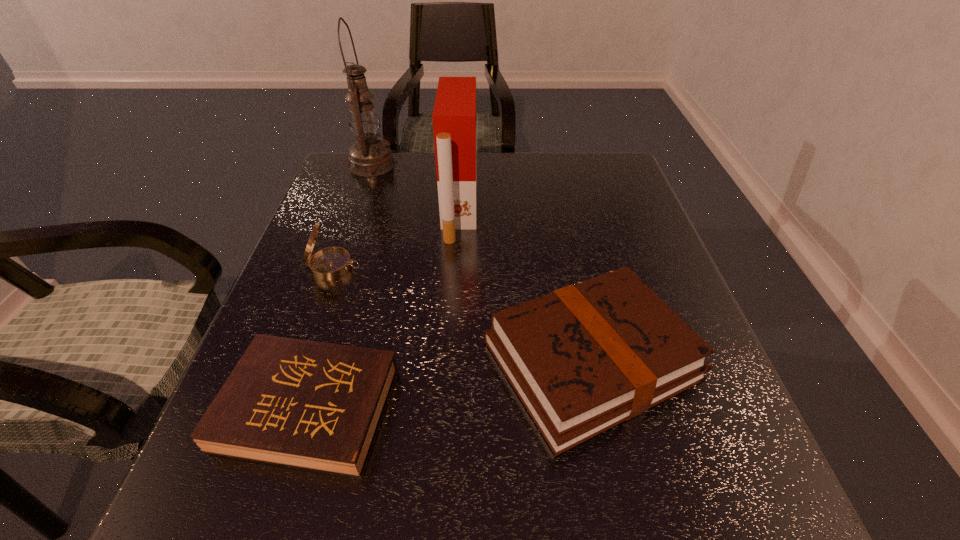
What are the coordinates of `free space located on the right of the oil lamp` in the screenshot? It's located at (412, 164).

Identify the location of vacant area situated on the front-facing side of the cigarette case. (496, 210).

Where is `vacant space located 0.260m with the dial facing the third nearest object`? The width and height of the screenshot is (960, 540). vacant space located 0.260m with the dial facing the third nearest object is located at coordinates (476, 267).

Where is `free space located on the left of the taller hardback book`? The height and width of the screenshot is (540, 960). free space located on the left of the taller hardback book is located at coordinates (368, 360).

Locate an element on the screen. The height and width of the screenshot is (540, 960). vacant region located on the back of the left hardback book is located at coordinates (363, 232).

This screenshot has width=960, height=540. I want to click on oil lamp that is at the far edge, so click(x=369, y=156).

I want to click on cigarette case that is at the far edge, so click(x=454, y=115).

This screenshot has width=960, height=540. What are the coordinates of `object positioned at the near edge` in the screenshot? It's located at (312, 405).

You are a GUI agent. You are given a task and a screenshot of the screen. Output one action in this format:
    pyautogui.click(x=<x>, y=<y>)
    Task: Click on the oil lamp located in the left edge section of the desktop
    
    Given the screenshot: What is the action you would take?
    pyautogui.click(x=369, y=156)

In order to click on compass present at the left edge in this screenshot , I will do `click(330, 263)`.